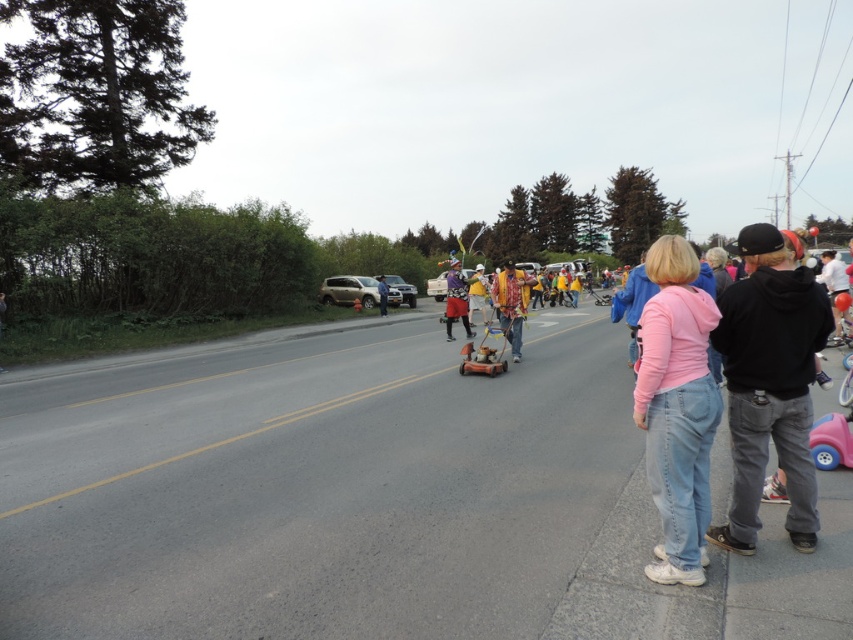
You are a photographer trying to capture the community event. You notice the satin silver suv at center and the yellow fabric at center. Which object is shorter?

The satin silver suv at center is shorter than the yellow fabric at center.

You are a pedestrian standing on the sidewalk on the right side of the road. You want to cross to the left side to join the parade. There is a satin silver suv at center and a yellow fabric at center in your path. Which object is closer to you, and can you safely step around it?

The satin silver suv at center is closer to you than the yellow fabric at center. Since the suv is closer, you can safely step around it if there is enough space, but you should also check for any ongoing traffic or event participants before proceeding.

You are standing on the sidewalk watching the parade. There are two points marked on the road. Which point is closer to you, point (358, 282) or point (469, 278)?

Point (358, 282) is closer to you because it is further to the viewer than point (469, 278).